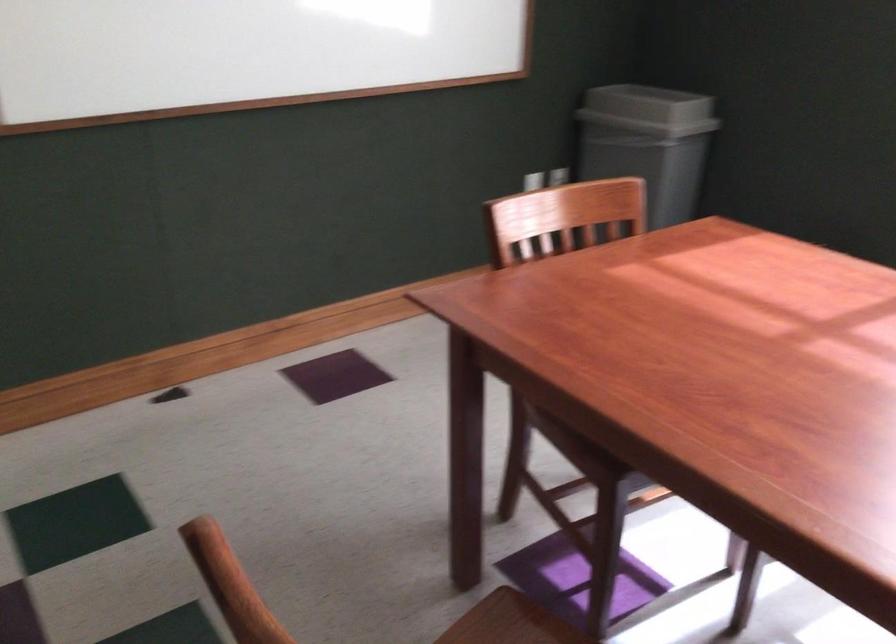
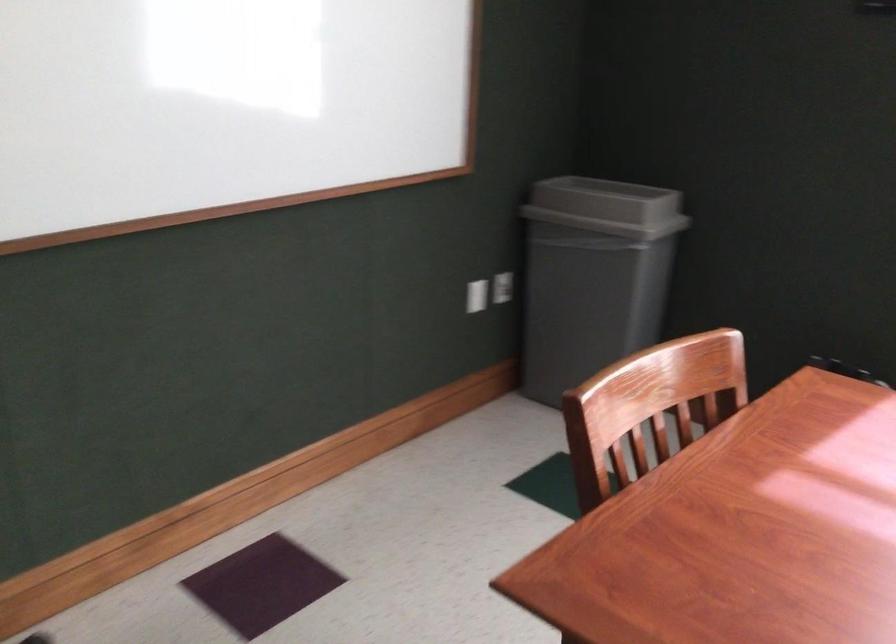
Find the pixel in the second image that matches the point at 557,178 in the first image.

(503, 287)